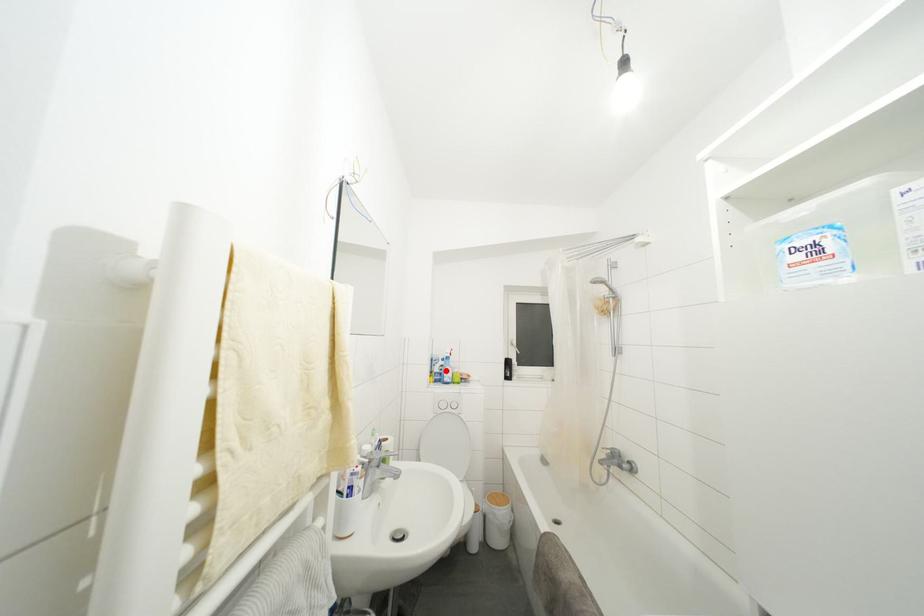
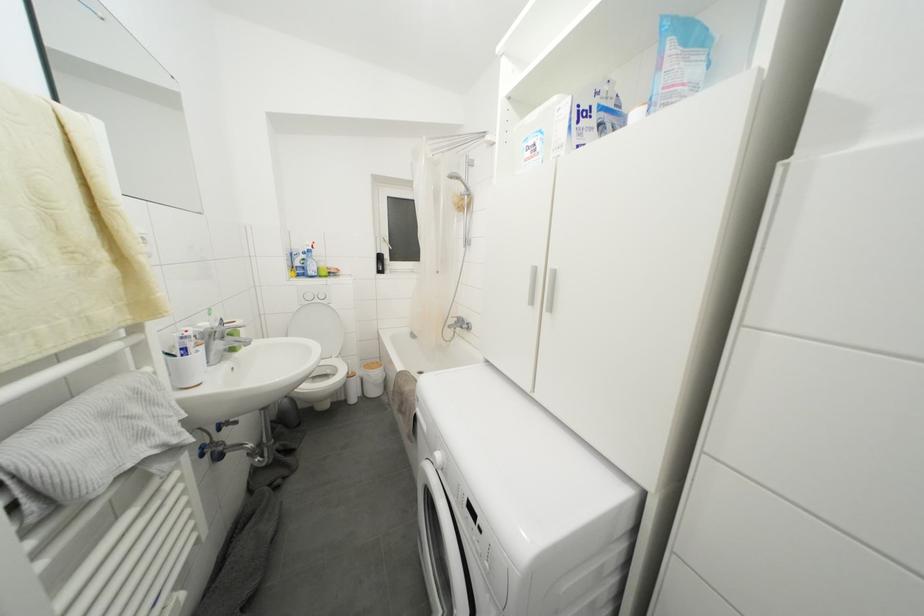
In the second image, find the point that corresponds to the highlighted location in the first image.

(308, 264)